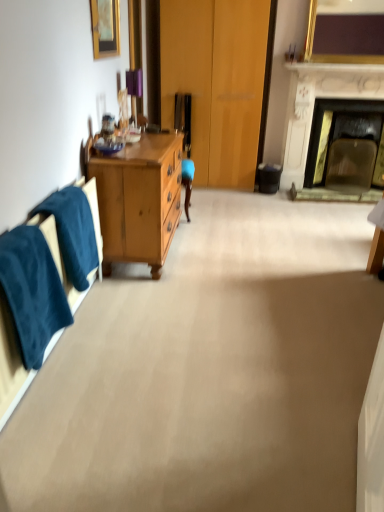
Question: Can you confirm if black plastic trash can at lower right is smaller than white marble fireplace at upper right?

Choices:
 (A) yes
 (B) no

Answer: (A)

Question: Is black plastic trash can at lower right oriented away from white marble fireplace at upper right?

Choices:
 (A) no
 (B) yes

Answer: (A)

Question: Does black plastic trash can at lower right appear on the left side of white marble fireplace at upper right?

Choices:
 (A) yes
 (B) no

Answer: (A)

Question: From a real-world perspective, is black plastic trash can at lower right under white marble fireplace at upper right?

Choices:
 (A) yes
 (B) no

Answer: (A)

Question: Can you confirm if black plastic trash can at lower right is bigger than white marble fireplace at upper right?

Choices:
 (A) no
 (B) yes

Answer: (A)

Question: Is black plastic trash can at lower right to the right of white marble fireplace at upper right from the viewer's perspective?

Choices:
 (A) yes
 (B) no

Answer: (B)

Question: Is black plastic trash can at lower right in front of gold metallic picture frame at upper right, which is counted as the second picture frame, starting from the bottom?

Choices:
 (A) no
 (B) yes

Answer: (A)

Question: From the image's perspective, would you say black plastic trash can at lower right is shown under gold metallic picture frame at upper right, which is counted as the second picture frame, starting from the bottom?

Choices:
 (A) no
 (B) yes

Answer: (B)

Question: From the image's perspective, is black plastic trash can at lower right on gold metallic picture frame at upper right, the first picture frame in the right-to-left sequence?

Choices:
 (A) yes
 (B) no

Answer: (B)

Question: From a real-world perspective, is black plastic trash can at lower right positioned under gold metallic picture frame at upper right, which is counted as the second picture frame, starting from the bottom, based on gravity?

Choices:
 (A) no
 (B) yes

Answer: (B)

Question: Can you confirm if black plastic trash can at lower right is positioned to the left of gold metallic picture frame at upper right, the second picture frame in the left-to-right sequence?

Choices:
 (A) yes
 (B) no

Answer: (A)

Question: Can you confirm if black plastic trash can at lower right is shorter than gold metallic picture frame at upper right, which is counted as the second picture frame, starting from the bottom?

Choices:
 (A) yes
 (B) no

Answer: (A)

Question: Can you confirm if black plastic trash can at lower right is taller than velvety blue towel at left, the first towel/napkin when ordered from front to back?

Choices:
 (A) yes
 (B) no

Answer: (B)